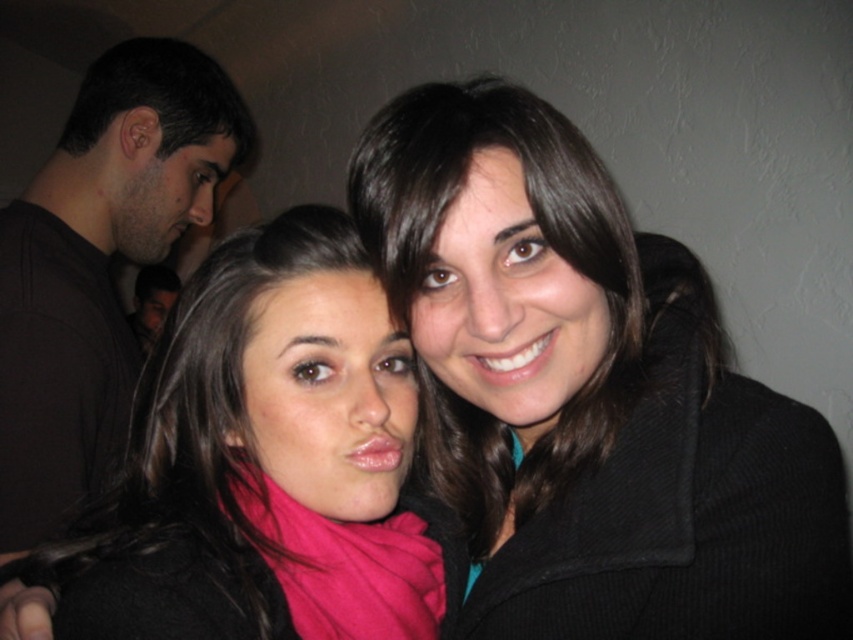
Is black woolen coat at center thinner than pink fabric scarf at center?

Yes, black woolen coat at center is thinner than pink fabric scarf at center.

Who is lower down, black woolen coat at center or pink fabric scarf at center?

pink fabric scarf at center

Between point (488, 291) and point (227, 476), which one is positioned behind?

The point (227, 476) is behind.

Identify the location of black woolen coat at center. click(589, 392).

Is black matte shirt at left positioned before matte pink scarf at center?

No, black matte shirt at left is behind matte pink scarf at center.

Can you confirm if black matte shirt at left is thinner than matte pink scarf at center?

No, black matte shirt at left is not thinner than matte pink scarf at center.

I want to click on black matte shirt at left, so click(x=97, y=264).

Which is more to the left, black woolen coat at center or matte pink scarf at center?

Positioned to the left is matte pink scarf at center.

Is black woolen coat at center further to the viewer compared to matte pink scarf at center?

No, it is not.

Is point (450, 436) more distant than point (386, 580)?

Yes, point (450, 436) is farther from viewer.

At what (x,y) coordinates should I click in order to perform the action: click on black woolen coat at center. Please return your answer as a coordinate pair (x, y). This screenshot has width=853, height=640. Looking at the image, I should click on (589, 392).